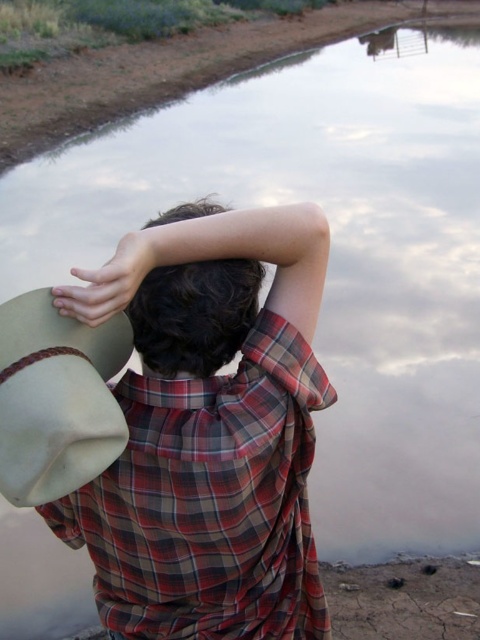
You are a photographer trying to capture the reflection of the beige felt hat at upper left and the matte beige hat at upper left in the water. Which hat will have a taller reflection in the water?

The beige felt hat at upper left will have a taller reflection in the water because it is much taller than the matte beige hat at upper left.

You are a photographer taking a picture of the scene described. You notice the point at coordinates (210,500) on the image. What object is located at this point?

The point at coordinates (210,500) indicates the plaid cotton shirt at back.

You are an artist sketching the scene and need to place the beige felt hat at upper left and the matte beige hat at upper left accurately. Which hat is located more to the left?

The beige felt hat at upper left is positioned more to the left than the matte beige hat at upper left.